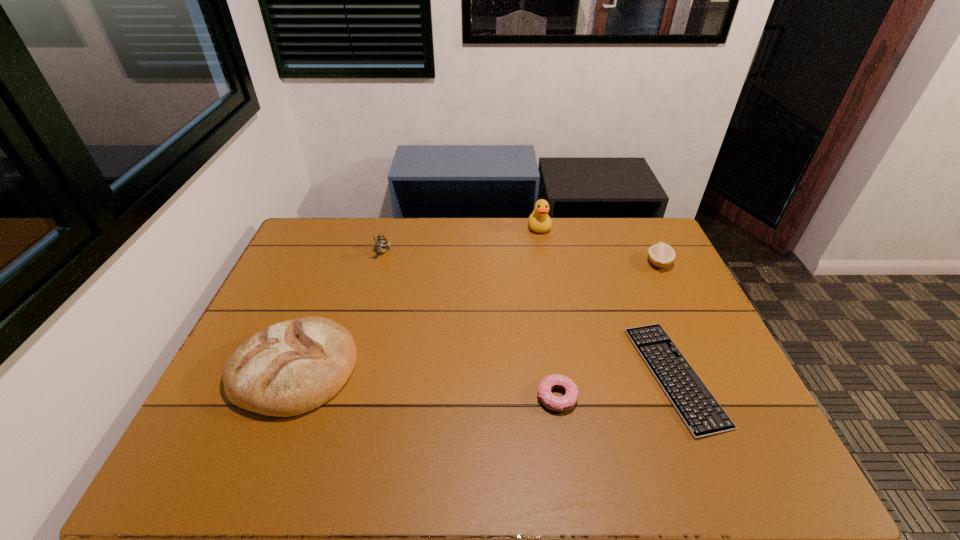
Locate an element on the screen. This screenshot has height=540, width=960. free space that satisfies the following two spatial constraints: 1. on the face of the shortest object; 2. on the left side of the snail is located at coordinates (349, 376).

You are a GUI agent. You are given a task and a screenshot of the screen. Output one action in this format:
    pyautogui.click(x=<x>, y=<y>)
    Task: Click on the free location that satisfies the following two spatial constraints: 1. at the beak of the third shortest object; 2. on the left side of the duck
    This screenshot has width=960, height=540.
    Given the screenshot: What is the action you would take?
    pyautogui.click(x=545, y=263)